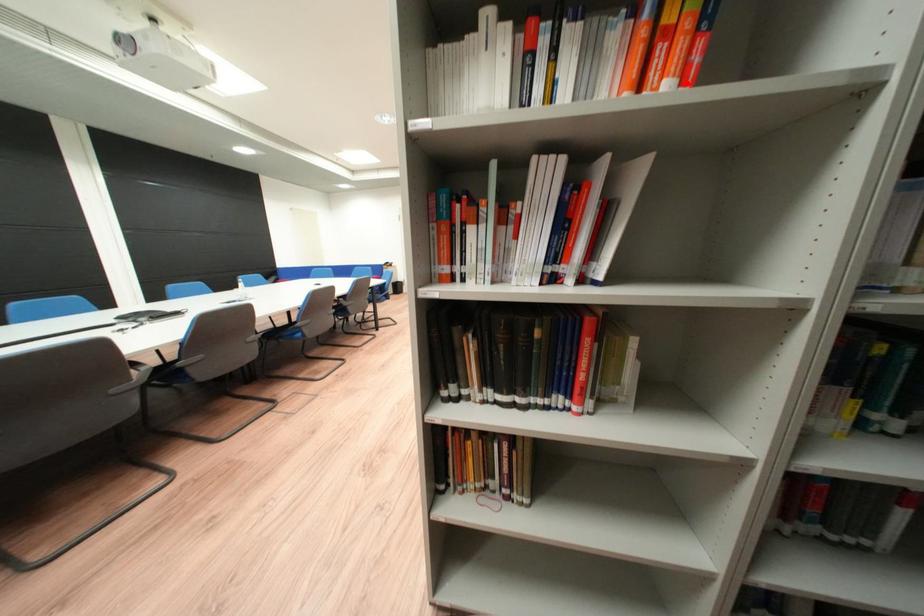
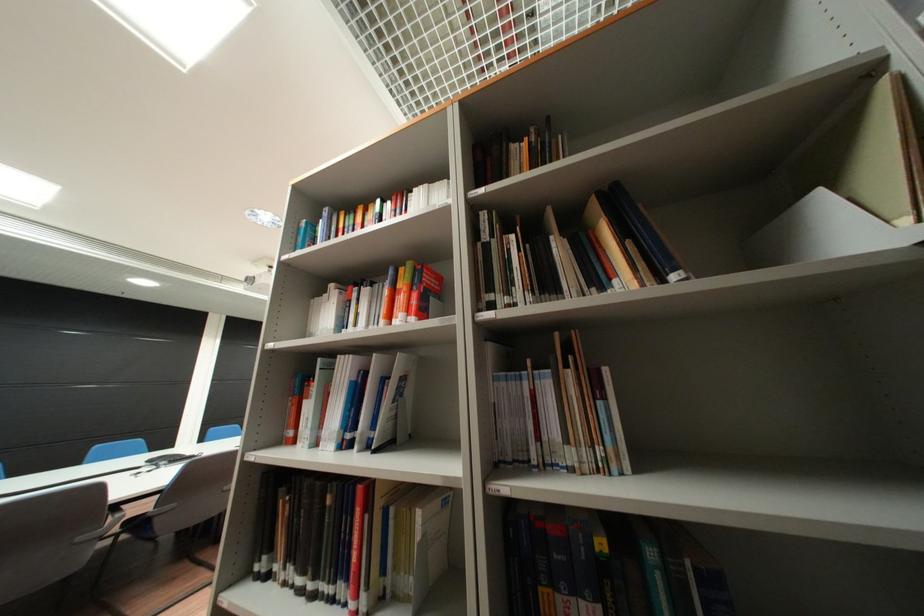
Locate, in the second image, the point that corresponds to the highlighted location in the first image.

(416, 315)